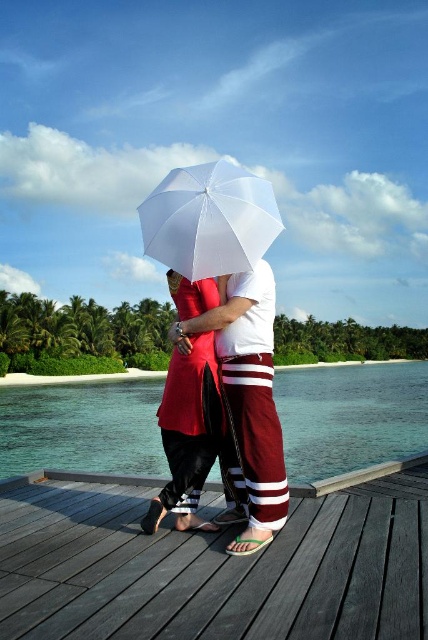
Does clear blue water at center appear over maroon striped pants at center?

No.

Describe the element at coordinates (350, 417) in the screenshot. This screenshot has width=428, height=640. I see `clear blue water at center` at that location.

Is point (329, 424) farther from camera compared to point (270, 440)?

Yes, point (329, 424) is behind point (270, 440).

I want to click on clear blue water at center, so click(350, 417).

Image resolution: width=428 pixels, height=640 pixels. What do you see at coordinates (211, 564) in the screenshot?
I see `dark wood dock at center` at bounding box center [211, 564].

Is dark wood dock at center above maroon striped pants at center?

No.

Who is more forward, (35, 502) or (192, 321)?

Positioned in front is point (192, 321).

This screenshot has height=640, width=428. I want to click on dark wood dock at center, so pos(211,564).

Does point (395, 442) come closer to viewer compared to point (219, 422)?

No, (395, 442) is further to viewer.

Between point (276, 403) and point (220, 417), which one is positioned behind?

The point (276, 403) is behind.

Where is `clear blue water at center`? This screenshot has width=428, height=640. clear blue water at center is located at coordinates (350, 417).